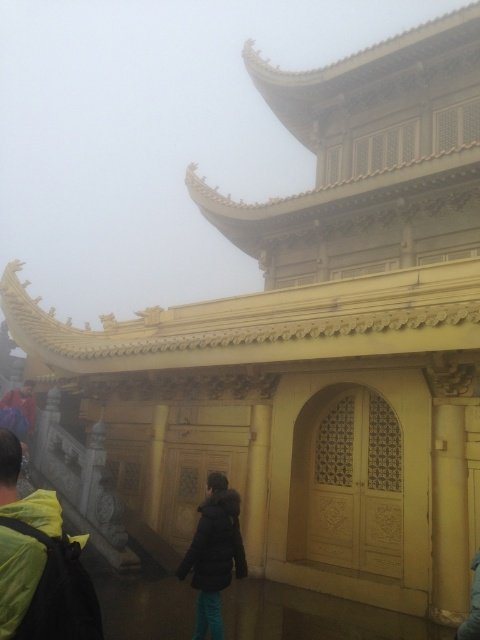
Question: Which of the following is the closest to the observer?

Choices:
 (A) yellow-green fabric backpack at lower left
 (B) black fuzzy coat at center

Answer: (A)

Question: Is yellow-green fabric backpack at lower left closer to camera compared to black fuzzy coat at center?

Choices:
 (A) no
 (B) yes

Answer: (B)

Question: Which point appears closest to the camera in this image?

Choices:
 (A) (215, 572)
 (B) (23, 582)

Answer: (B)

Question: Is yellow-green fabric backpack at lower left further to camera compared to black fuzzy coat at center?

Choices:
 (A) no
 (B) yes

Answer: (A)

Question: Does yellow-green fabric backpack at lower left have a greater width compared to black fuzzy coat at center?

Choices:
 (A) no
 (B) yes

Answer: (B)

Question: Among these points, which one is nearest to the camera?

Choices:
 (A) (1, 468)
 (B) (205, 497)

Answer: (A)